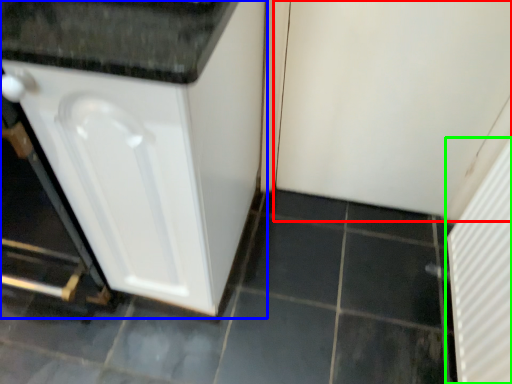
Question: Which object is the farthest from screen door (highlighted by a red box)? Choose among these: cabinetry (highlighted by a blue box) or screen door (highlighted by a green box).

Choices:
 (A) cabinetry
 (B) screen door

Answer: (A)